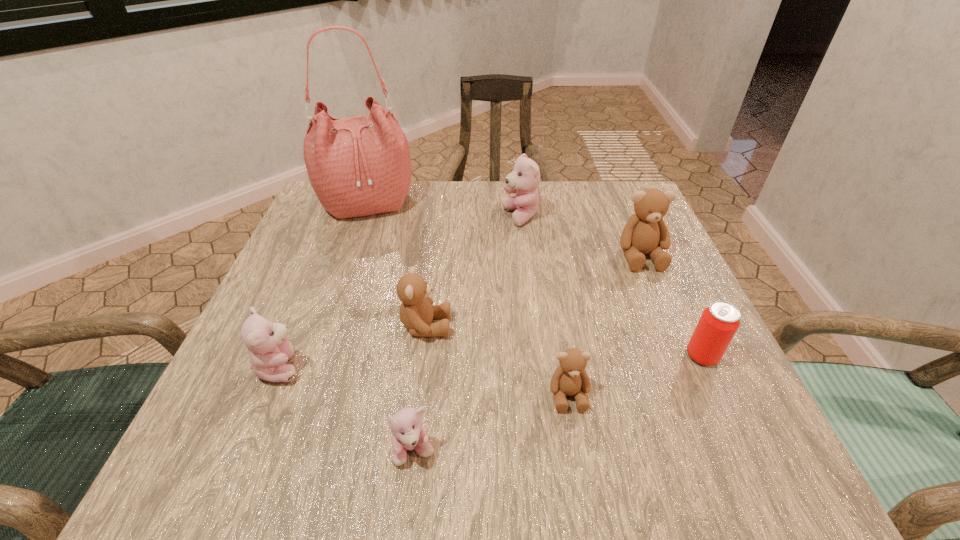
Identify the location of free space located 0.100m at the face of the second smallest pink teddy bear. pos(363,367).

Find the location of a particular element. free location located on the back of the red beer can is located at coordinates (636, 214).

Find the location of `vacant area situated 0.050m on the face of the nearest brown teddy bear`. vacant area situated 0.050m on the face of the nearest brown teddy bear is located at coordinates (577, 446).

This screenshot has width=960, height=540. What are the coordinates of `handbag located at the far edge` in the screenshot? It's located at click(358, 166).

I want to click on teddy bear present at the far edge, so click(x=524, y=180).

At what (x,y) coordinates should I click in order to perform the action: click on object that is at the near edge. Please return your answer as a coordinate pair (x, y). The width and height of the screenshot is (960, 540). Looking at the image, I should click on (408, 433).

I want to click on handbag situated at the left edge, so click(358, 166).

This screenshot has height=540, width=960. I want to click on teddy bear at the left edge, so click(269, 350).

Locate an element on the screen. The width and height of the screenshot is (960, 540). teddy bear positioned at the right edge is located at coordinates (645, 232).

This screenshot has width=960, height=540. In order to click on beer can at the right edge in this screenshot , I will do `click(719, 322)`.